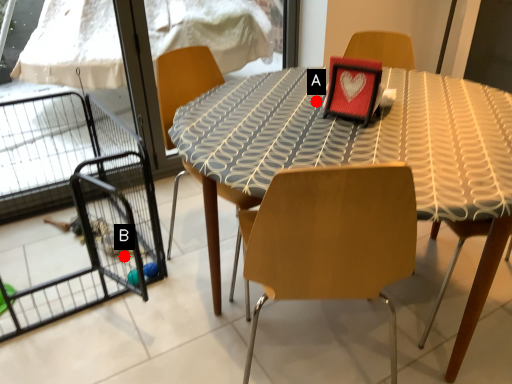
Question: Two points are circled on the image, labeled by A and B beside each circle. Which of the following is the closest to the observer?

Choices:
 (A) A is closer
 (B) B is closer

Answer: (A)